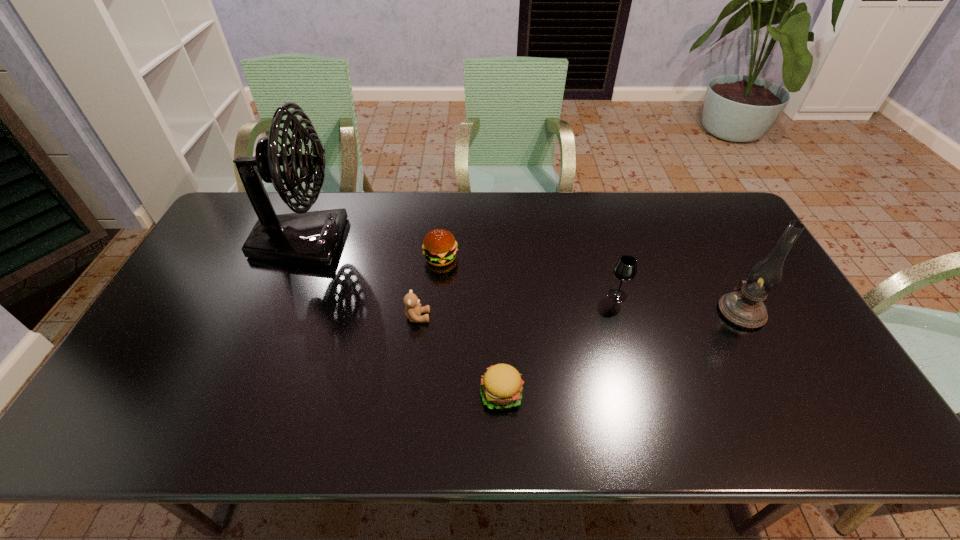
The image size is (960, 540). I want to click on the nearer hamburger, so click(501, 386).

Locate an element on the screen. This screenshot has height=540, width=960. vacant region located 0.120m in front of the tallest object to blow air is located at coordinates (384, 242).

What are the coordinates of `vacant space located 0.290m on the front of the second tallest object` in the screenshot? It's located at (805, 434).

Image resolution: width=960 pixels, height=540 pixels. What are the coordinates of `vacant area located on the left of the fifth object from left to right` in the screenshot? It's located at (521, 295).

Find the location of `vacant space situated on the front of the left hamburger`. vacant space situated on the front of the left hamburger is located at coordinates (434, 331).

Where is `vacant area situated on the front-facing side of the teddy bear`? vacant area situated on the front-facing side of the teddy bear is located at coordinates (534, 317).

Identify the location of free space located 0.140m on the right of the nearest object. (582, 393).

You are a GUI agent. You are given a task and a screenshot of the screen. Output one action in this format:
    pyautogui.click(x=<x>, y=<y>)
    Task: Click on the object that is at the far edge
    
    Given the screenshot: What is the action you would take?
    pyautogui.click(x=312, y=238)

What are the coordinates of `object that is at the near edge` in the screenshot? It's located at (501, 386).

This screenshot has height=540, width=960. What are the coordinates of `object positioned at the left edge` in the screenshot? It's located at (312, 238).